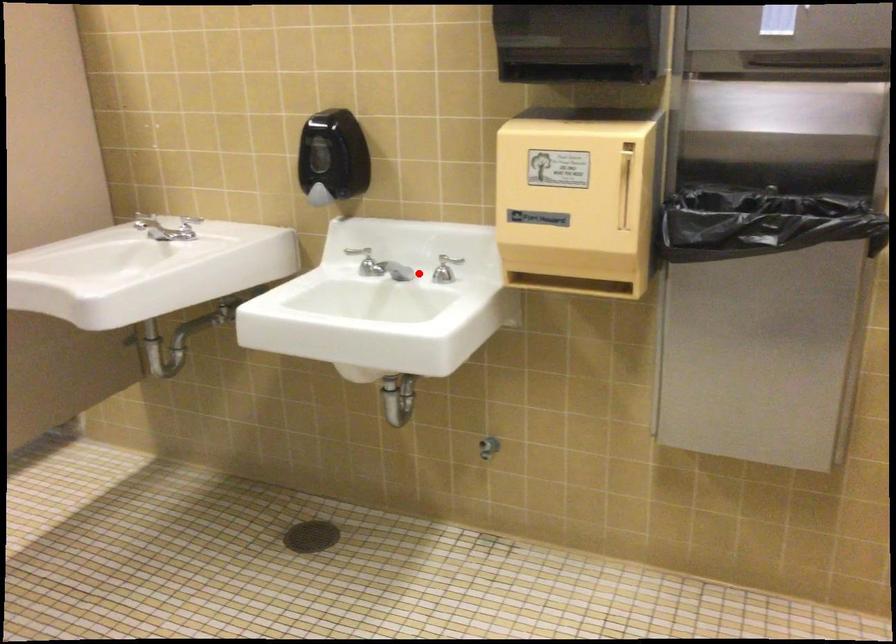
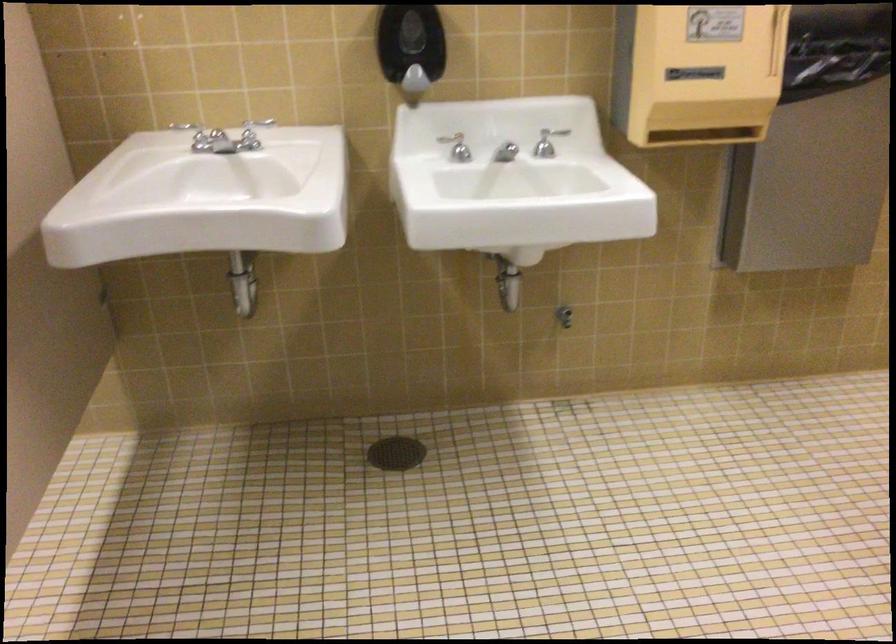
The point at the highlighted location is marked in the first image. Where is the corresponding point in the second image?

(505, 152)